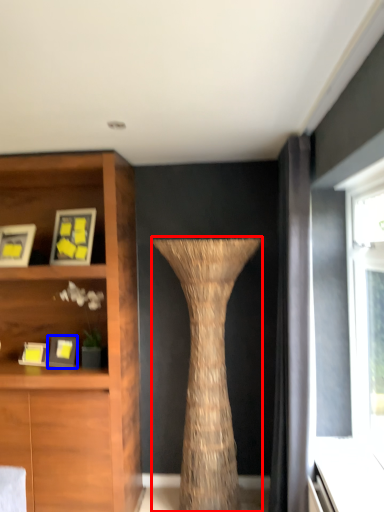
Question: Which object is closer to the camera taking this photo, vase (highlighted by a red box) or picture frame (highlighted by a blue box)?

Choices:
 (A) vase
 (B) picture frame

Answer: (A)